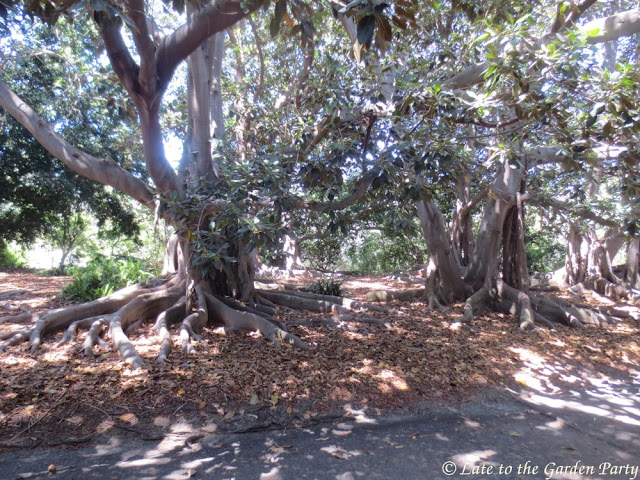
Find the location of a particular element. The width and height of the screenshot is (640, 480). light reflections is located at coordinates (x=527, y=384), (x=612, y=416), (x=180, y=434), (x=475, y=448), (x=61, y=351).